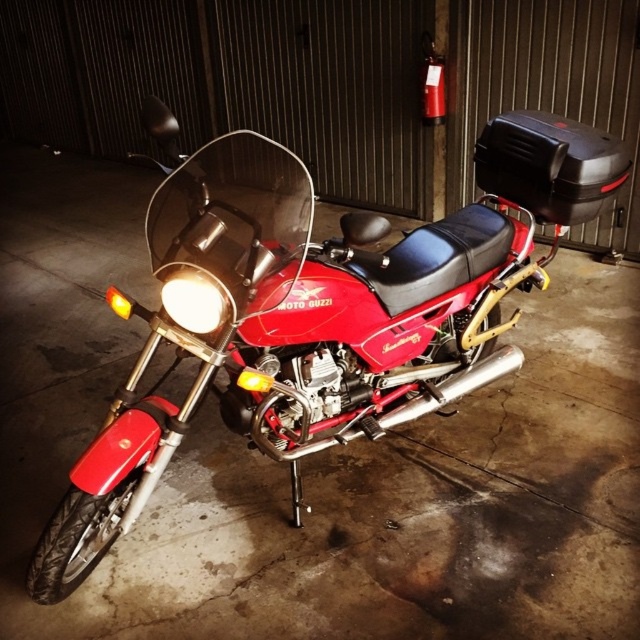
Question: Can you confirm if shiny red motorcycle at center is positioned below matte white headlight at center?

Choices:
 (A) no
 (B) yes

Answer: (A)

Question: Observing the image, what is the correct spatial positioning of shiny red motorcycle at center in reference to matte white headlight at center?

Choices:
 (A) below
 (B) above

Answer: (B)

Question: Does shiny red motorcycle at center appear over matte white headlight at center?

Choices:
 (A) yes
 (B) no

Answer: (A)

Question: Which of the following is the farthest from the observer?

Choices:
 (A) (353, 362)
 (B) (218, 280)

Answer: (A)